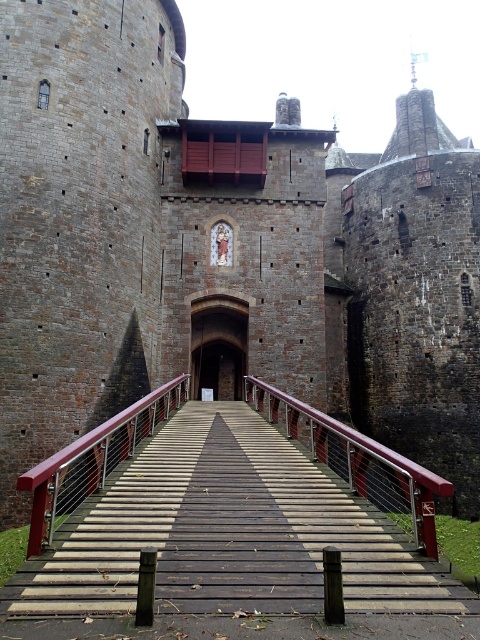
Does wooden bridge at center have a greater height compared to brown stone archway at center?

No.

Who is more distant from viewer, (205, 580) or (193, 372)?

Point (193, 372)

Where is `wooden bridge at center`? This screenshot has width=480, height=640. wooden bridge at center is located at coordinates (230, 536).